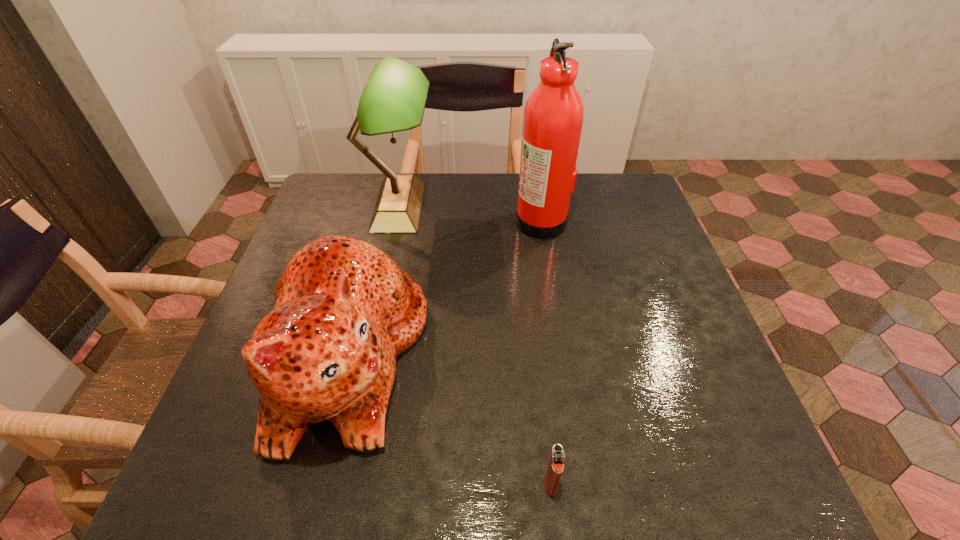
The height and width of the screenshot is (540, 960). I want to click on vacant space located on the face of the second nearest object, so click(525, 356).

The image size is (960, 540). What are the coordinates of `free region located on the left of the shortest object` in the screenshot? It's located at (361, 484).

I want to click on fire extinguisher present at the far edge, so point(553,118).

Locate an element on the screen. table lamp present at the far edge is located at coordinates (394, 98).

Identify the location of cat at the near edge. This screenshot has width=960, height=540. (344, 311).

Where is `igniter that is at the near edge`? Image resolution: width=960 pixels, height=540 pixels. igniter that is at the near edge is located at coordinates (555, 467).

At what (x,y) coordinates should I click in order to perform the action: click on table lamp that is positioned at the left edge. Please return your answer as a coordinate pair (x, y). Image resolution: width=960 pixels, height=540 pixels. Looking at the image, I should click on (394, 98).

You are a GUI agent. You are given a task and a screenshot of the screen. Output one action in this format:
    pyautogui.click(x=<x>, y=<y>)
    Task: Click on the cat located in the left edge section of the desktop
    Image resolution: width=960 pixels, height=540 pixels.
    Given the screenshot: What is the action you would take?
    pyautogui.click(x=344, y=311)

I want to click on object situated at the far left corner, so click(x=394, y=98).

At what (x,y) coordinates should I click in order to perform the action: click on object present at the near left corner. Please return your answer as a coordinate pair (x, y). Image resolution: width=960 pixels, height=540 pixels. Looking at the image, I should click on (344, 311).